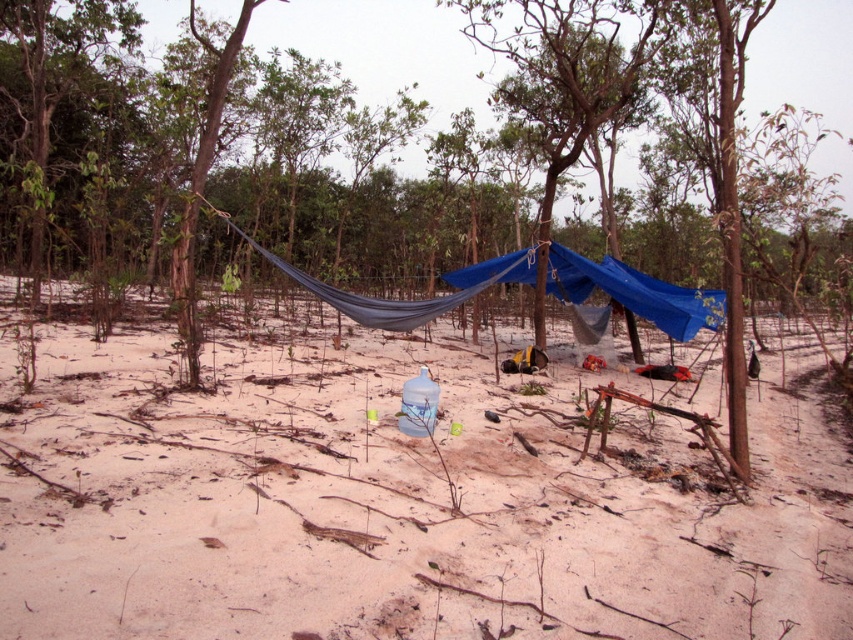
Question: Does white sandy ground at center come in front of blue fabric canopy at center?

Choices:
 (A) yes
 (B) no

Answer: (A)

Question: Does white sandy ground at center appear over blue fabric canopy at center?

Choices:
 (A) no
 (B) yes

Answer: (A)

Question: Which point is closer to the camera?

Choices:
 (A) blue fabric canopy at center
 (B) white sandy ground at center

Answer: (B)

Question: Does white sandy ground at center have a greater width compared to blue fabric canopy at center?

Choices:
 (A) yes
 (B) no

Answer: (B)